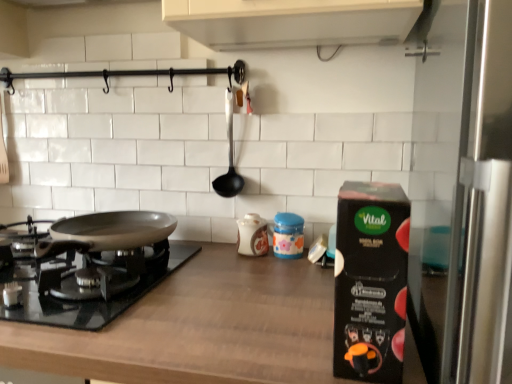
You are a GUI agent. You are given a task and a screenshot of the screen. Output one action in this format:
    pyautogui.click(x=<x>, y=<y>)
    Task: Click on the vacant space to the left of matte ceramic jar at center, arranged as the 3th kitchen appliance when viewed from the front
    The width and height of the screenshot is (512, 384).
    Given the screenshot: What is the action you would take?
    pyautogui.click(x=204, y=253)